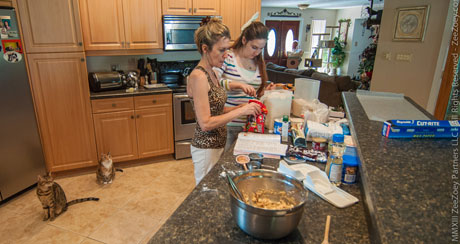
Where is `microwave`? This screenshot has height=244, width=460. microwave is located at coordinates (183, 33).